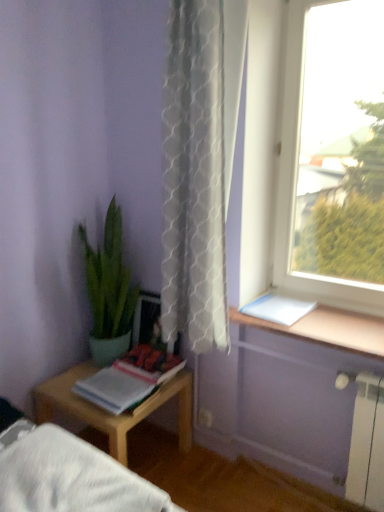
Question: Considering the positions of matte paper book at lower left, the 2th book viewed from the right, and white paper at upper right, the first book positioned from the right, in the image, is matte paper book at lower left, the 2th book viewed from the right, bigger or smaller than white paper at upper right, the first book positioned from the right,?

Choices:
 (A) small
 (B) big

Answer: (B)

Question: Do you think matte paper book at lower left, the 1th book from the left, is within white paper at upper right, the second book positioned from the bottom, or outside of it?

Choices:
 (A) inside
 (B) outside

Answer: (B)

Question: Which object is positioned farthest from the green glossy plant at left?

Choices:
 (A) wooden table at left
 (B) transparent glass window at upper right
 (C) white paper at upper right, positioned as the second book in left-to-right order
 (D) white fabric bed frame at lower left
 (E) white textured curtain at center

Answer: (B)

Question: Which object is positioned closest to the white textured curtain at center?

Choices:
 (A) white fabric bed frame at lower left
 (B) matte paper book at lower left, placed as the second book when sorted from top to bottom
 (C) transparent glass window at upper right
 (D) wooden table at left
 (E) green glossy plant at left

Answer: (C)